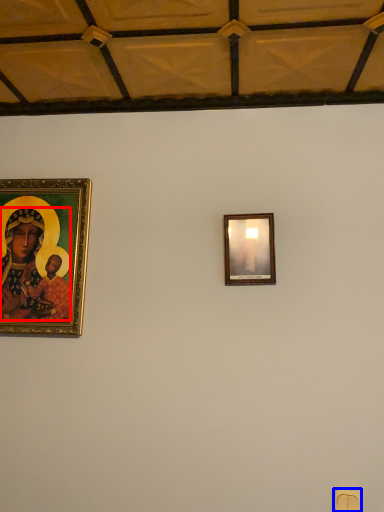
Question: Which of the following is the farthest to the observer, person (highlighted by a red box) or light switch (highlighted by a blue box)?

Choices:
 (A) person
 (B) light switch

Answer: (A)